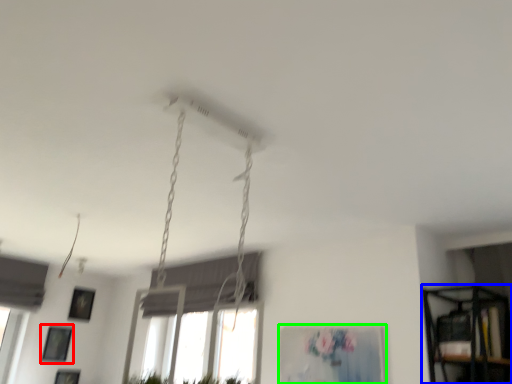
Question: Which is nearer to the picture frame (highlighted by a red box)? shelf (highlighted by a blue box) or picture frame (highlighted by a green box).

Choices:
 (A) shelf
 (B) picture frame

Answer: (B)